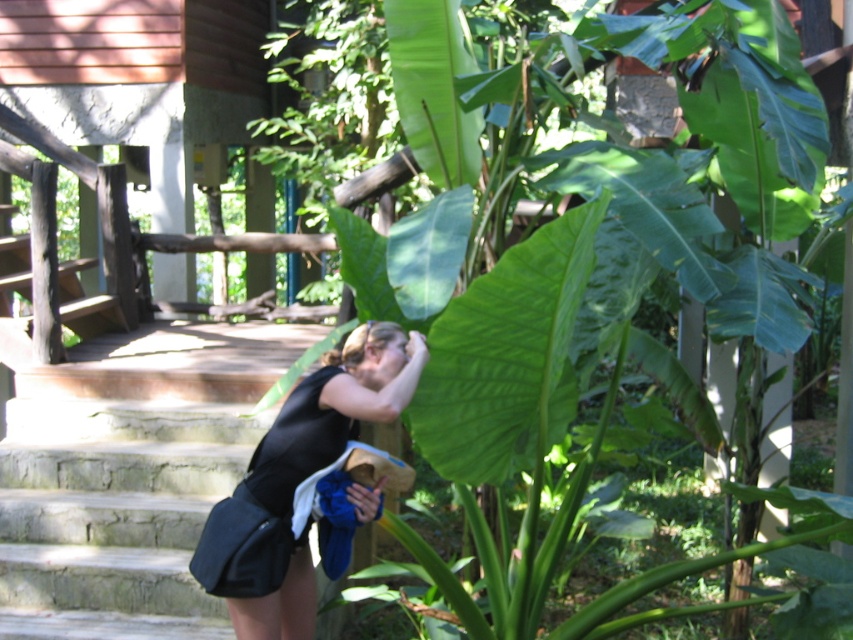
You are a photographer trying to set up a tripod. You have a black matte skirt at lower center and stone stairs at lower left. Which object is shorter and can be used as a base for the tripod?

The stone stairs at lower left is shorter than the black matte skirt at lower center, so it can be used as a base for the tripod.